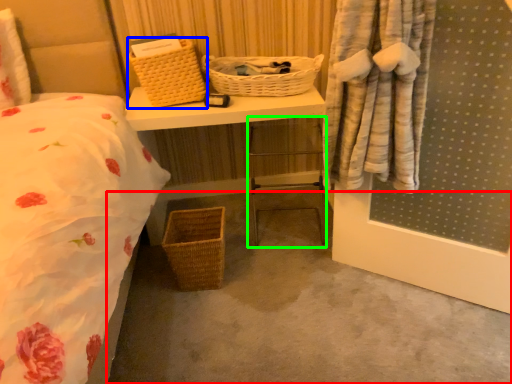
Question: Estimate the real-world distances between objects in this image. Which object is farther from concrete (highlighted by a red box), picnic basket (highlighted by a blue box) or chair (highlighted by a green box)?

Choices:
 (A) picnic basket
 (B) chair

Answer: (A)